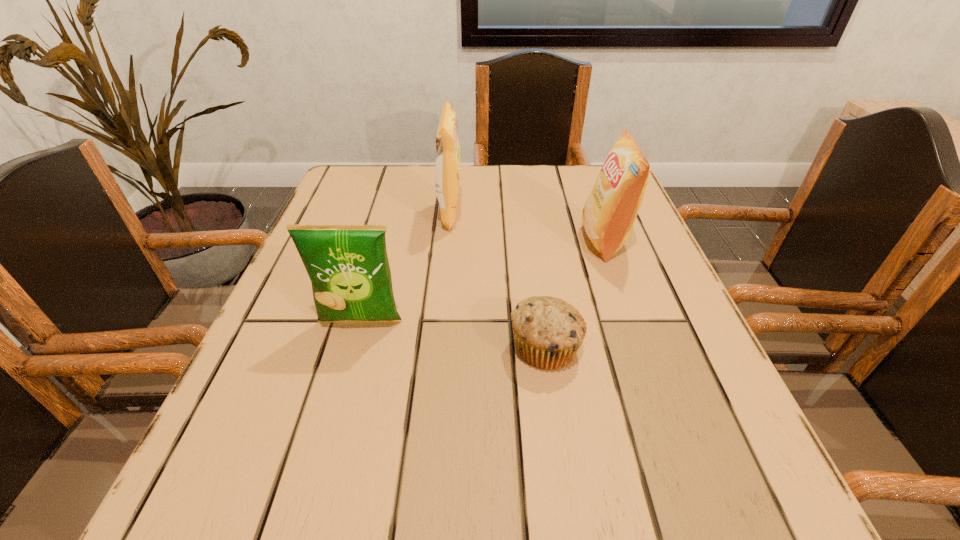
Find the location of a particular element. the second object from left to right is located at coordinates (447, 170).

Find the location of a particular element. the rightmost object is located at coordinates (610, 211).

Image resolution: width=960 pixels, height=540 pixels. I want to click on the nearest crisp (potato chip), so click(348, 266).

Find the location of a particular element. The width and height of the screenshot is (960, 540). the leftmost object is located at coordinates (348, 266).

Image resolution: width=960 pixels, height=540 pixels. In order to click on the second object from right to left in this screenshot , I will do `click(548, 332)`.

This screenshot has width=960, height=540. What are the coordinates of `muffin` in the screenshot? It's located at (548, 332).

At what (x,y) coordinates should I click in order to perform the action: click on free space located 0.370m on the front of the second crisp (potato chip) from right to left with the logo. Please return your answer as a coordinate pair (x, y). Looking at the image, I should click on (619, 214).

In order to click on free space located on the front-facing side of the rightmost object in this screenshot , I will do tap(540, 240).

Find the location of a particular element. The image size is (960, 540). vacant position located on the front-facing side of the rightmost object is located at coordinates (499, 240).

Find the location of `vacant space located 0.360m on the front-facing side of the rightmost object`. vacant space located 0.360m on the front-facing side of the rightmost object is located at coordinates (416, 240).